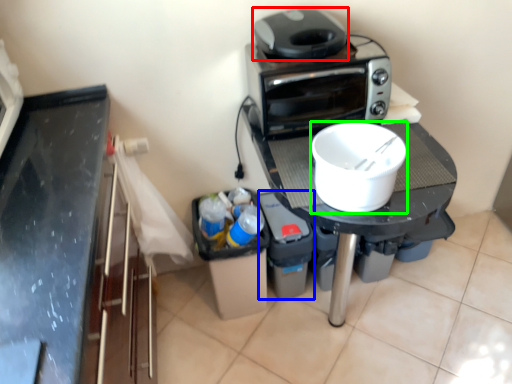
Question: Which is nearer to the home appliance (highlighted by a red box)? appliance (highlighted by a blue box) or kitchen appliance (highlighted by a green box).

Choices:
 (A) appliance
 (B) kitchen appliance

Answer: (B)